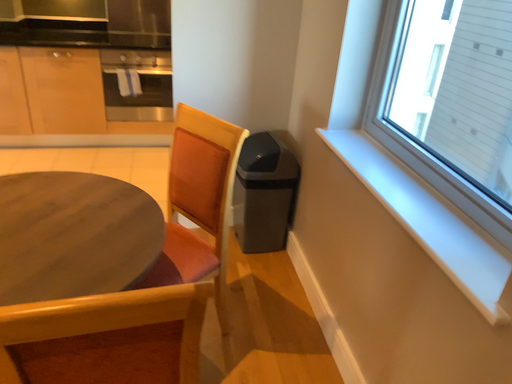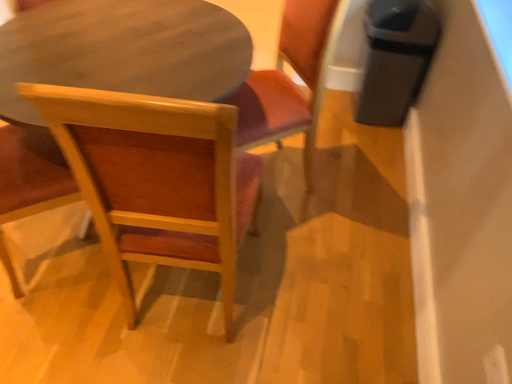
Question: Which way did the camera rotate in the video?

Choices:
 (A) rotated upward
 (B) rotated downward

Answer: (B)